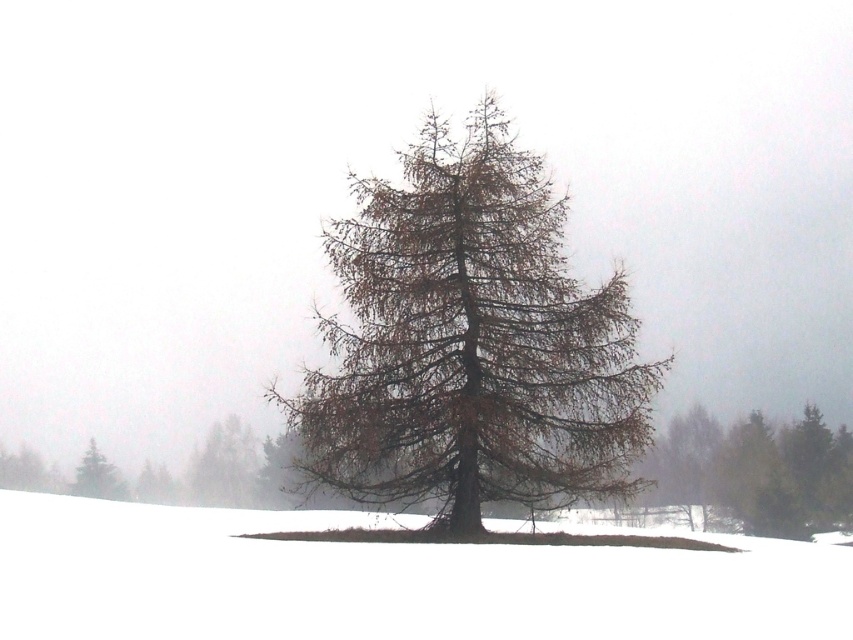
Question: Which object is positioned closest to the brown/dried wood tree at center?

Choices:
 (A) white fluffy snow at center
 (B) green matte tree at lower left

Answer: (A)

Question: Is white fluffy snow at center behind green matte tree at lower left?

Choices:
 (A) yes
 (B) no

Answer: (B)

Question: Which point appears farthest from the camera in this image?

Choices:
 (A) (96, 451)
 (B) (833, 560)

Answer: (A)

Question: Is white fluffy snow at center smaller than green matte tree at lower left?

Choices:
 (A) yes
 (B) no

Answer: (B)

Question: Based on their relative distances, which object is nearer to the green matte tree at lower left?

Choices:
 (A) brown/dried wood tree at center
 (B) white fluffy snow at center

Answer: (B)

Question: Is brown/dried wood tree at center positioned at the back of white fluffy snow at center?

Choices:
 (A) no
 (B) yes

Answer: (B)